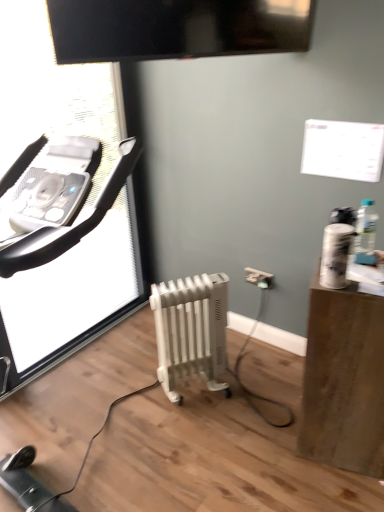
Where is `vacant space in front of white plastic radiator at center`? vacant space in front of white plastic radiator at center is located at coordinates (198, 434).